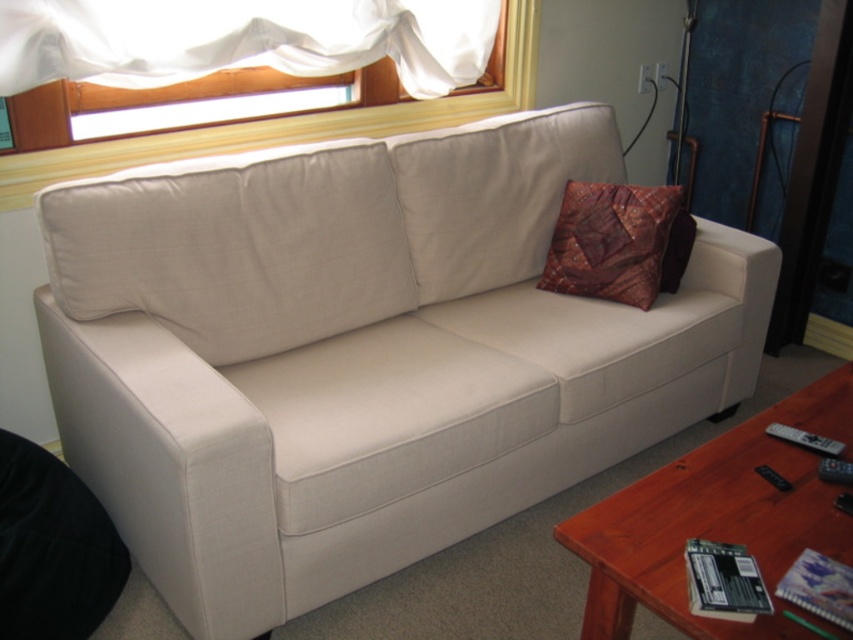
You are standing in the living room and want to move from the sofa to the coffee table. Which point, point (x=262, y=388) or point (x=358, y=17), is closer to you as you move towards the coffee table?

Point (x=262, y=388) is closer to the viewer than point (x=358, y=17), so it is the closer point when moving towards the coffee table.

You are planning to place a floor lamp in the living room corner. The beige fabric couch at center is under the white sheer curtain at upper left. Where should you place the floor lamp to avoid blocking the light from the window?

The floor lamp should be placed to the side of the beige fabric couch at center, away from the white sheer curtain at upper left to ensure the light from the window isn not blocked.

You are standing in the living room and want to place a 1.5 meter long decorative bench on the floor. The bench needs to be placed between the sofa and the brown wood coffee table at lower right. Is there enough space for the bench?

The brown wood coffee table at lower right is 1.27 meters away from the viewer. Since the bench is 1.5 meters long, it would require more space than what is available between the sofa and the coffee table. Therefore, the bench cannot be placed there.